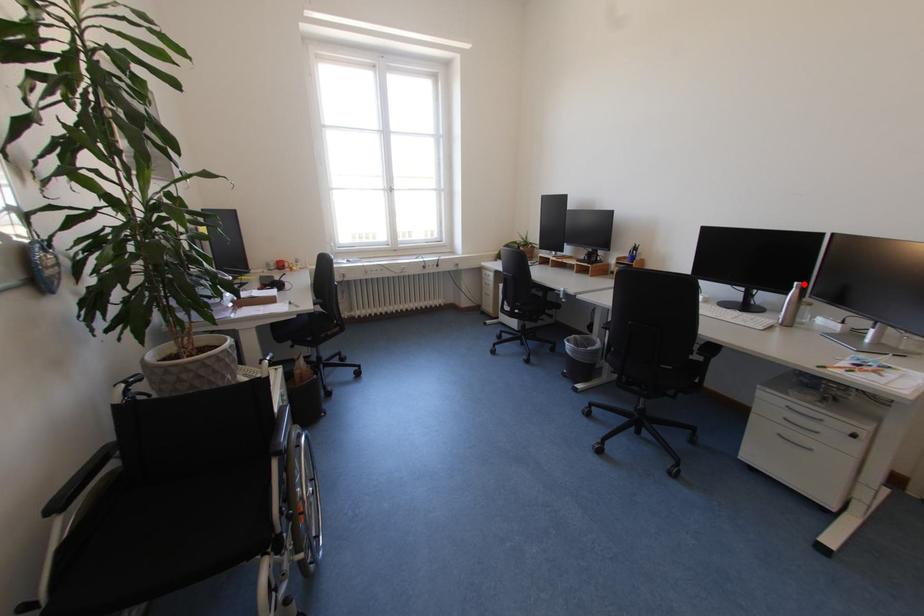
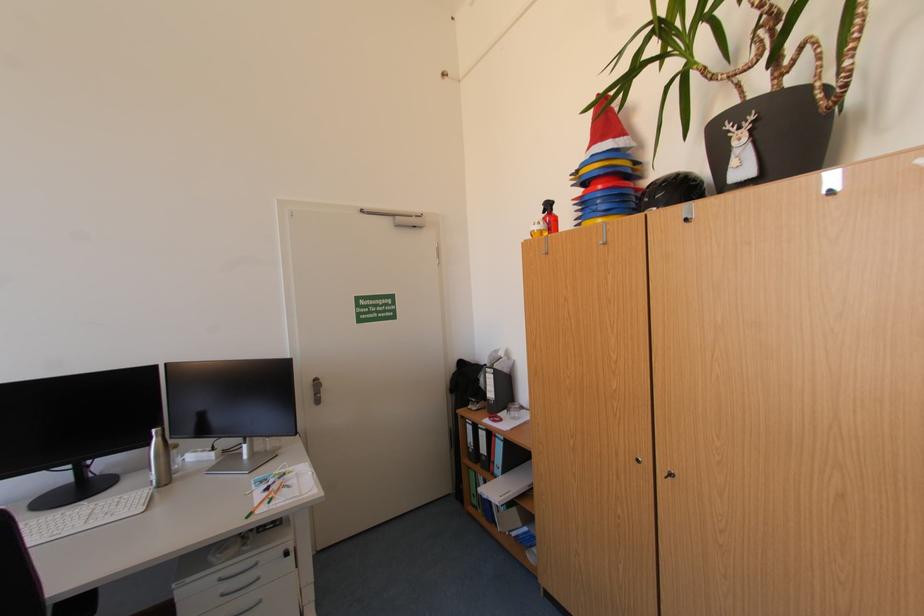
In the second image, find the point that corresponds to the highlighted location in the first image.

(161, 431)